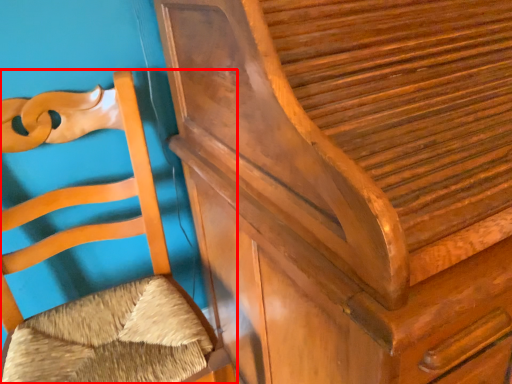
Question: From the image's perspective, what is the correct spatial relationship of furniture (annotated by the red box) in relation to furniture?

Choices:
 (A) above
 (B) below

Answer: (B)